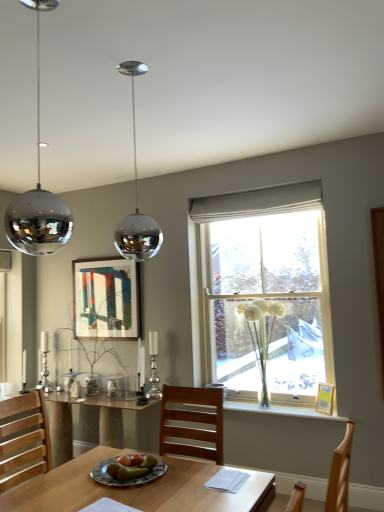
Question: From a real-world perspective, is polished chrome sphere at center physically above wooden picture frame at window, which is counted as the 1th picture frame, starting from the right?

Choices:
 (A) yes
 (B) no

Answer: (A)

Question: From the image's perspective, would you say polished chrome sphere at center is shown under wooden picture frame at window, which is counted as the 1th picture frame, starting from the right?

Choices:
 (A) yes
 (B) no

Answer: (B)

Question: Is polished chrome sphere at center oriented towards wooden picture frame at window, the 2th picture frame viewed from the left?

Choices:
 (A) yes
 (B) no

Answer: (B)

Question: Considering the relative sizes of polished chrome sphere at center and wooden picture frame at window, positioned as the 2th picture frame in back-to-front order, in the image provided, is polished chrome sphere at center bigger than wooden picture frame at window, positioned as the 2th picture frame in back-to-front order,?

Choices:
 (A) no
 (B) yes

Answer: (B)

Question: Can you confirm if polished chrome sphere at center is shorter than wooden picture frame at window, the 2th picture frame viewed from the left?

Choices:
 (A) no
 (B) yes

Answer: (A)

Question: Considering the relative sizes of polished chrome sphere at center and wooden picture frame at window, the first picture frame when ordered from bottom to top, in the image provided, is polished chrome sphere at center thinner than wooden picture frame at window, the first picture frame when ordered from bottom to top,?

Choices:
 (A) no
 (B) yes

Answer: (A)

Question: Is white glass vase at center to the right of wooden picture frame at window, positioned as the 2th picture frame in back-to-front order, from the viewer's perspective?

Choices:
 (A) yes
 (B) no

Answer: (B)

Question: Is wooden picture frame at window, positioned as the 2th picture frame in top-to-bottom order, at the back of white glass vase at center?

Choices:
 (A) yes
 (B) no

Answer: (B)

Question: Does white glass vase at center turn towards wooden picture frame at window, positioned as the 2th picture frame in back-to-front order?

Choices:
 (A) yes
 (B) no

Answer: (B)

Question: Considering the relative sizes of white glass vase at center and wooden picture frame at window, the 2th picture frame viewed from the left, in the image provided, is white glass vase at center bigger than wooden picture frame at window, the 2th picture frame viewed from the left,?

Choices:
 (A) no
 (B) yes

Answer: (B)

Question: Can you confirm if white glass vase at center is thinner than wooden picture frame at window, which appears as the first picture frame when viewed from the front?

Choices:
 (A) no
 (B) yes

Answer: (A)

Question: Is white glass vase at center closer to camera compared to wooden picture frame at window, which appears as the first picture frame when viewed from the front?

Choices:
 (A) yes
 (B) no

Answer: (A)

Question: Is clear glass vase at center shorter than green matte plate at center?

Choices:
 (A) yes
 (B) no

Answer: (B)